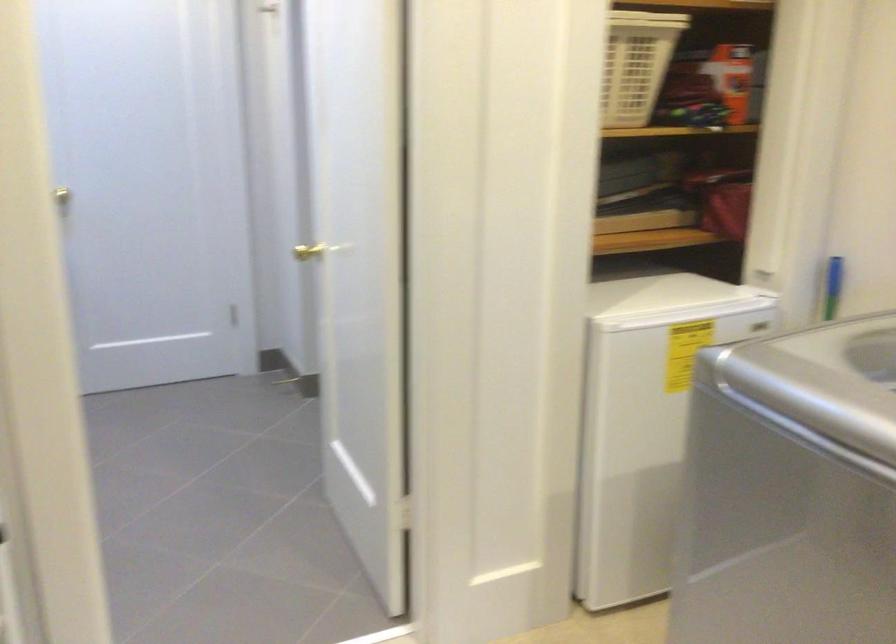
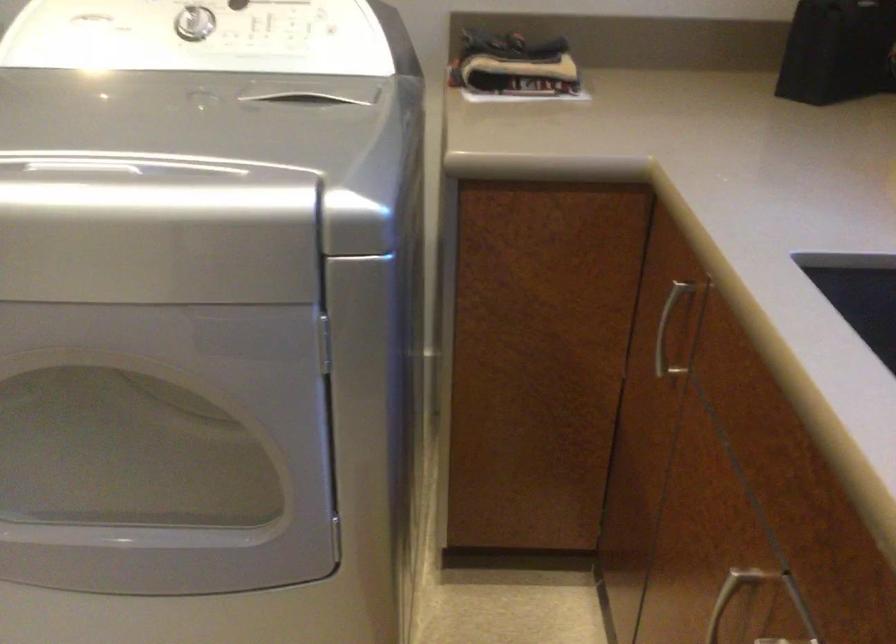
How did the camera likely rotate?

The camera's rotation is toward right-down.